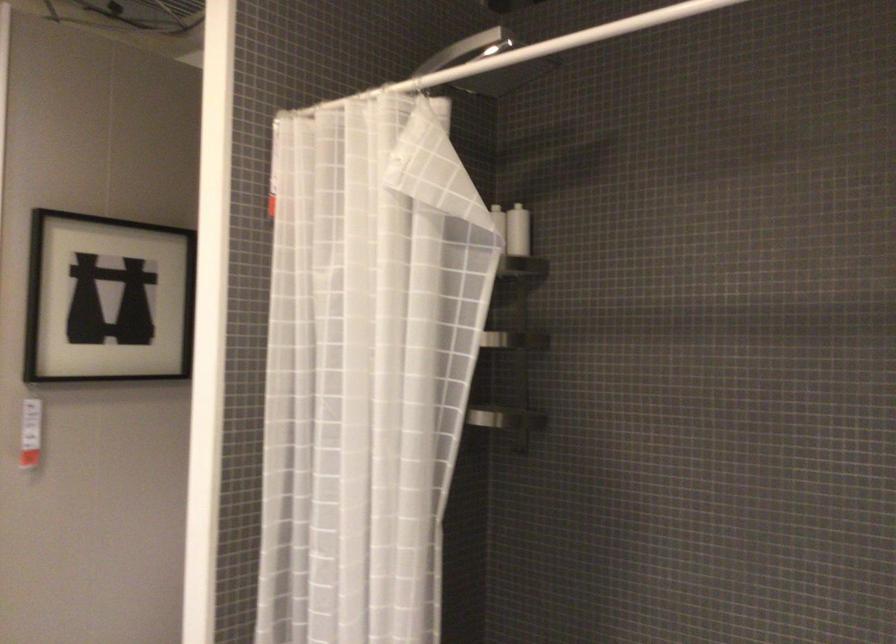
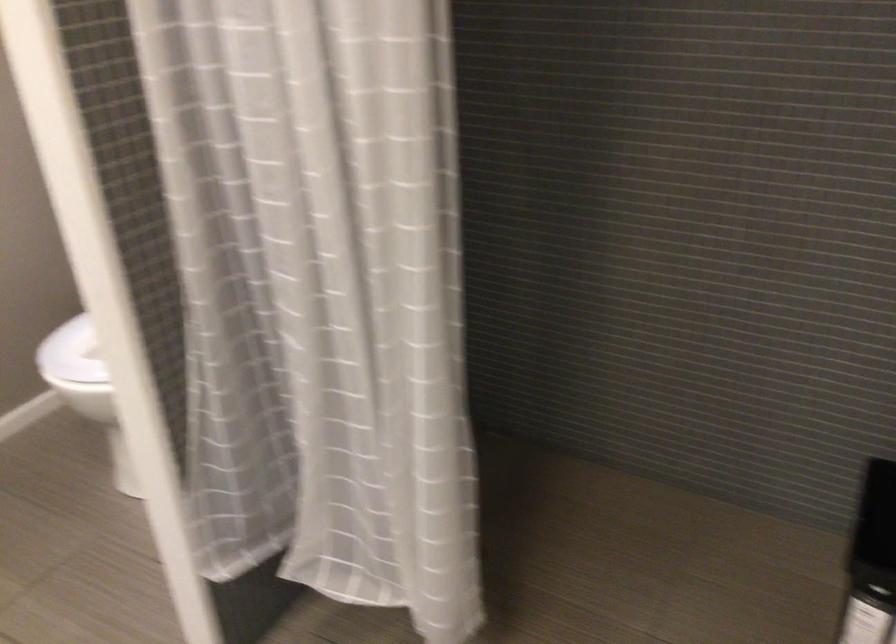
Question: How did the camera likely rotate?

Choices:
 (A) Left
 (B) Right
 (C) Up
 (D) Down

Answer: (D)